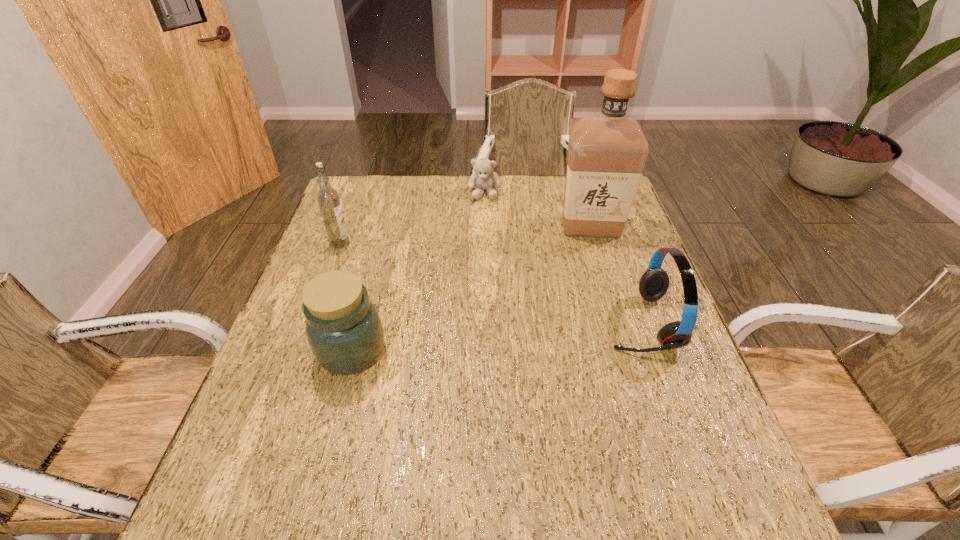
Find the location of a particular element. free space located 0.110m with the microphone attached to the side of the headset is located at coordinates (560, 322).

Where is `free space located on the label of the vodka`? The height and width of the screenshot is (540, 960). free space located on the label of the vodka is located at coordinates (414, 286).

Image resolution: width=960 pixels, height=540 pixels. What are the coordinates of `vacant region located 0.350m on the label of the vodka` in the screenshot? It's located at (441, 301).

The width and height of the screenshot is (960, 540). Identify the location of free space located 0.200m on the label of the vodka. (397, 276).

Image resolution: width=960 pixels, height=540 pixels. In order to click on vacant point located on the front-facing side of the liquor in this screenshot , I will do `click(522, 293)`.

Where is `free space located 0.130m on the front-facing side of the liquor`? This screenshot has width=960, height=540. free space located 0.130m on the front-facing side of the liquor is located at coordinates (551, 262).

The image size is (960, 540). I want to click on vacant space situated 0.050m on the front-facing side of the liquor, so click(x=565, y=247).

Find the location of a particular element. The height and width of the screenshot is (540, 960). vacant space located on the face of the farthest object is located at coordinates pos(482,222).

Image resolution: width=960 pixels, height=540 pixels. I want to click on free location located on the face of the farthest object, so click(x=483, y=215).

The image size is (960, 540). I want to click on vacant region located 0.340m on the face of the farthest object, so click(477, 274).